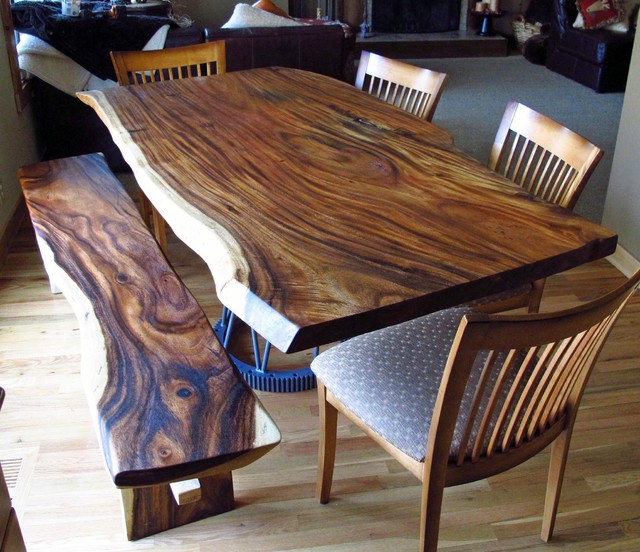
What are the coordinates of `bench` in the screenshot? It's located at (128, 300).